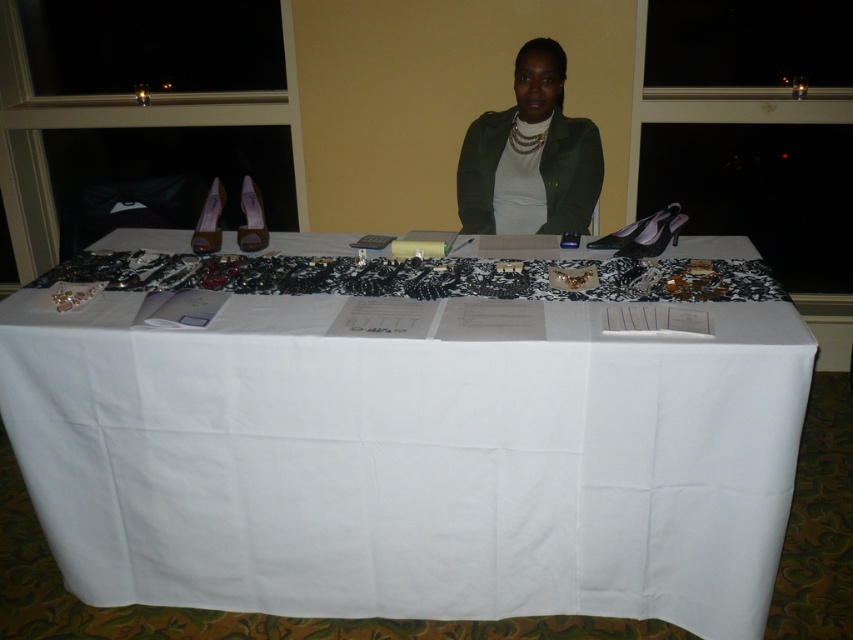
Question: From the image, what is the correct spatial relationship of white fabric table at center in relation to green matte jacket at center?

Choices:
 (A) above
 (B) below

Answer: (B)

Question: Does white fabric table at center lie in front of green matte jacket at center?

Choices:
 (A) no
 (B) yes

Answer: (B)

Question: Which point is farther from the camera taking this photo?

Choices:
 (A) (534, 68)
 (B) (364, 508)

Answer: (A)

Question: Is white fabric table at center wider than green matte jacket at center?

Choices:
 (A) yes
 (B) no

Answer: (A)

Question: Which point is closer to the camera?

Choices:
 (A) coord(654,474)
 (B) coord(488,122)

Answer: (A)